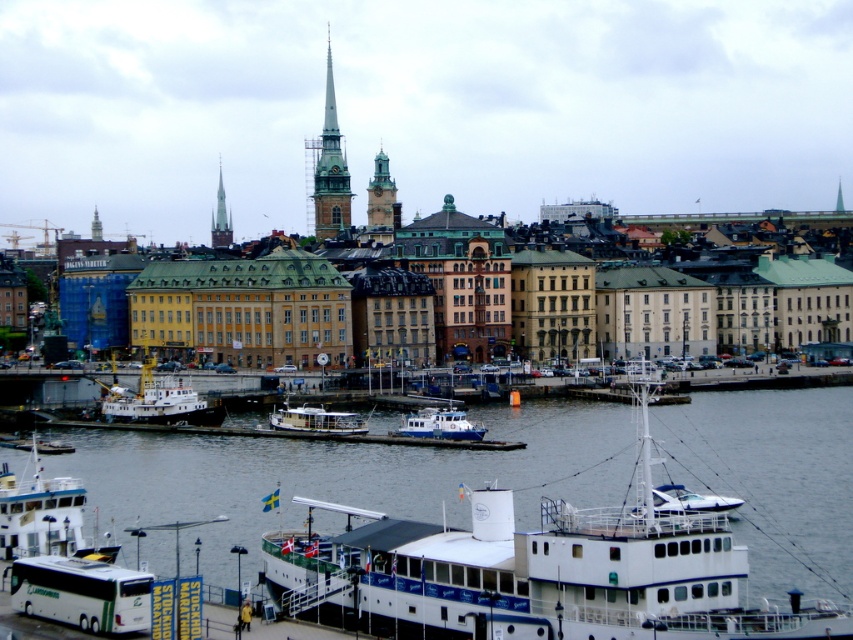
Looking at this image, you are standing on the pier and looking at the point marked at coordinates (317,420). What object is this point located on?

The point marked at coordinates (317,420) is located on the wooden polished boat at center.

You are a tour guide explaining the boats in the waterfront scene. You need to inform visitors about the size comparison between the wooden polished boat at center and the white plastic boat at center. What should you tell them?

The wooden polished boat at center occupies less space than the white plastic boat at center, so the white plastic boat at center is larger in size.